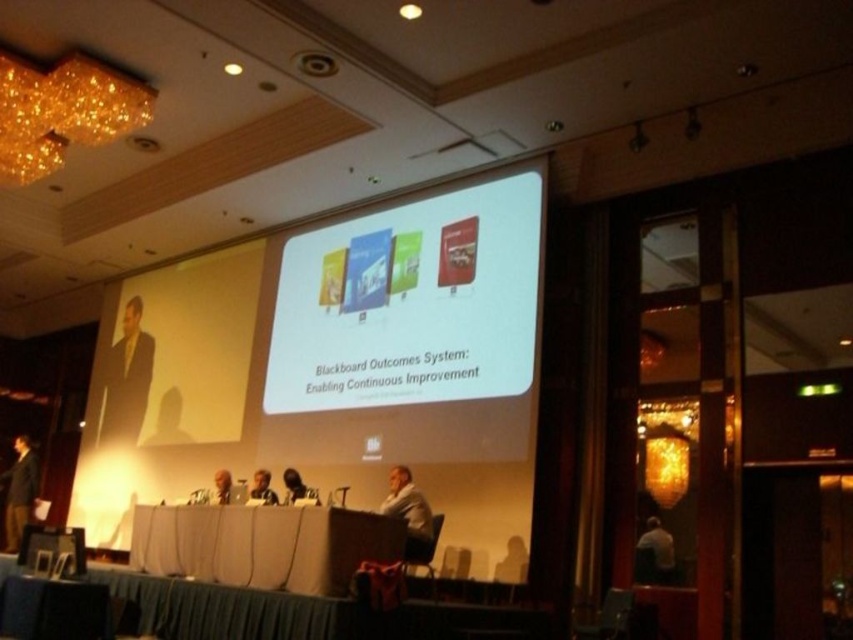
In the scene shown: Who is taller, translucent yellow figure at center or smooth skin face at center?

translucent yellow figure at center is taller.

Can you confirm if translucent yellow figure at center is thinner than smooth skin face at center?

Incorrect, translucent yellow figure at center's width is not less than smooth skin face at center's.

Find the location of `translucent yellow figure at center`. translucent yellow figure at center is located at coordinates (167, 420).

Who is shorter, matte black suit at left or dark suit at left?

With less height is dark suit at left.

Is point (126, 394) positioned in front of point (26, 454)?

No, it is behind (26, 454).

Image resolution: width=853 pixels, height=640 pixels. I want to click on matte black suit at left, so click(x=126, y=378).

Is light gray suit at center further to camera compared to smooth skin face at center?

No, it is not.

Is point (403, 480) positioned after point (271, 500)?

No, (403, 480) is in front of (271, 500).

Does point (398, 486) lie in front of point (259, 474)?

Yes, it is.

Locate an element on the screen. light gray suit at center is located at coordinates pyautogui.click(x=409, y=513).